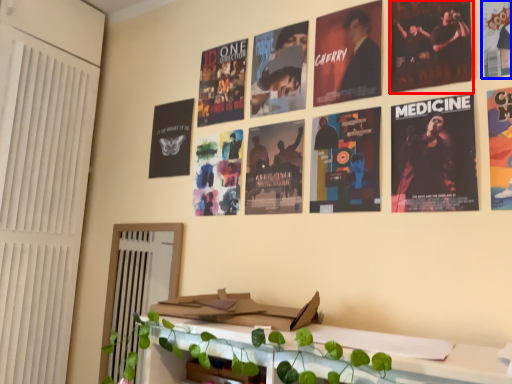
Question: Among these objects, which one is farthest to the camera, poster (highlighted by a red box) or poster (highlighted by a blue box)?

Choices:
 (A) poster
 (B) poster

Answer: (A)